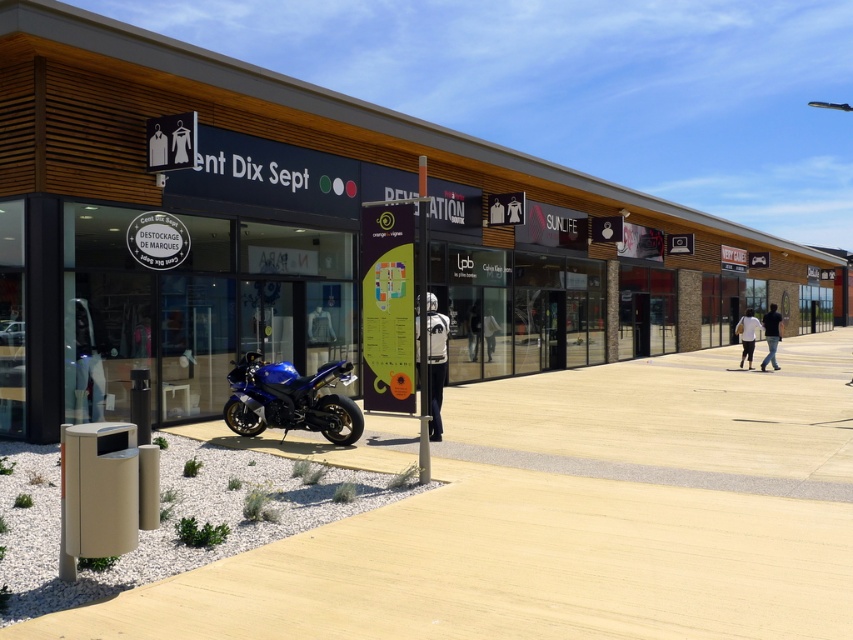
Question: Which point is closer to the camera?

Choices:
 (A) (659, 474)
 (B) (688, 260)
 (C) (326, 438)

Answer: (A)

Question: Among these points, which one is farthest from the camera?

Choices:
 (A) (247, 362)
 (B) (851, 440)

Answer: (A)

Question: Does matte wood mall at center appear under beige concrete pavement at center?

Choices:
 (A) no
 (B) yes

Answer: (A)

Question: In this image, where is matte wood mall at center located relative to beige concrete pavement at center?

Choices:
 (A) right
 (B) left

Answer: (A)

Question: Is the position of matte wood mall at center more distant than that of beige concrete pavement at center?

Choices:
 (A) no
 (B) yes

Answer: (B)

Question: Which object is positioned farthest from the beige concrete pavement at center?

Choices:
 (A) matte wood mall at center
 (B) blue metallic motorcycle at lower left

Answer: (A)